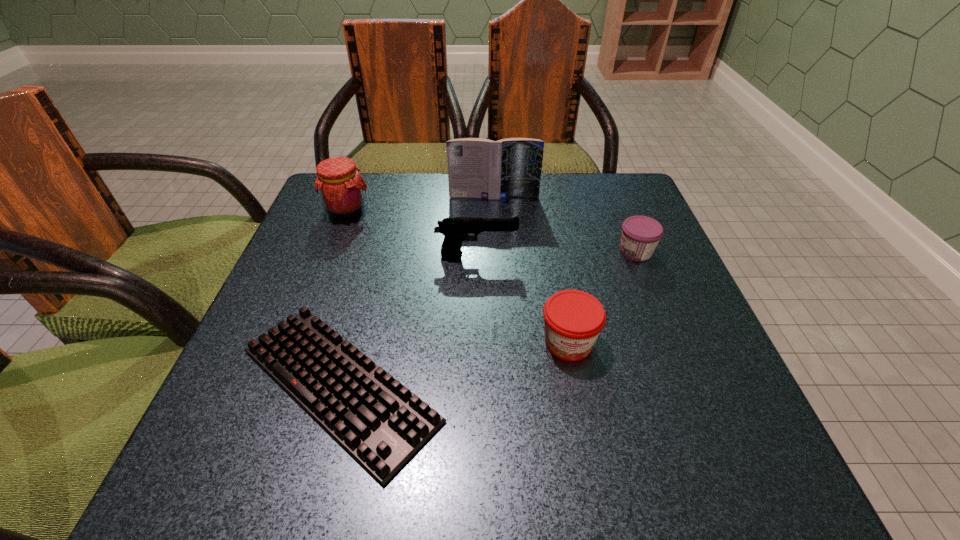
Where is `vacant space at the far right corner`? vacant space at the far right corner is located at coordinates (633, 196).

Find the location of a particular element. This screenshot has height=540, width=960. empty location between the tallest object and the rightmost jam is located at coordinates (564, 224).

You are a GUI agent. You are given a task and a screenshot of the screen. Output one action in this format:
    pyautogui.click(x=<x>, y=<y>)
    Task: Click on the empty space between the rightmost object and the book
    
    Given the screenshot: What is the action you would take?
    pyautogui.click(x=564, y=224)

Where is `blank region between the shortest object and the pistol`? blank region between the shortest object and the pistol is located at coordinates (408, 319).

Where is `free space between the leftmost jam and the nearest jam`? The image size is (960, 540). free space between the leftmost jam and the nearest jam is located at coordinates (457, 276).

Identify the location of empty space between the rightmost object and the shortest object. (488, 318).

Locate an element on the screen. This screenshot has width=960, height=540. vacant space that's between the leftmost jam and the computer keyboard is located at coordinates (343, 297).

Locate an element on the screen. vacant region between the computer keyboard and the farthest jam is located at coordinates (343, 297).

At what (x,y) coordinates should I click in order to perform the action: click on unoccupied area between the rightmost jam and the book. Please return your answer as a coordinate pair (x, y). This screenshot has height=540, width=960. Looking at the image, I should click on (564, 224).

At what (x,y) coordinates should I click in order to perform the action: click on blank region between the book and the shortest object. Please return your answer as a coordinate pair (x, y). Looking at the image, I should click on (417, 291).